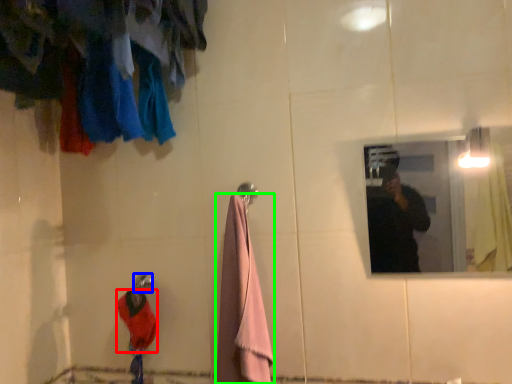
Question: Estimate the real-world distances between objects in this image. Which object is closer to clothing (highlighted by a red box), shower (highlighted by a blue box) or towel/napkin (highlighted by a green box)?

Choices:
 (A) shower
 (B) towel/napkin

Answer: (A)